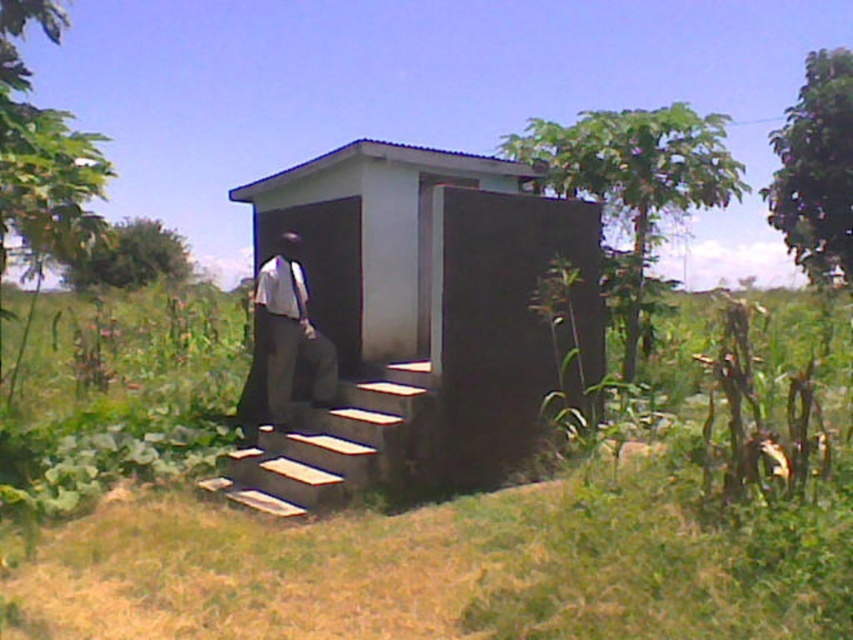
You are a hiker who needs to secure your gear. You have a white fabric tie at center and a concrete block hut at center nearby. Which object can you use to tie something to?

The white fabric tie at center can be used to tie something to because it is designed for tying, while the concrete block hut at center is a large structure and not suitable for tying.

You are standing in front of a small building in a tropical area. You see a concrete block hut at center and a white shirt at center. Which object is taller?

The concrete block hut at center is much taller than the white shirt at center.

You are standing at the origin point of the coordinate system. You want to walk to the concrete block hut at center. Which direction should you go?

Since the concrete block hut at center is located at coordinate point (426, 307), you should walk directly towards the center of the coordinate system as it is very close to the center point.